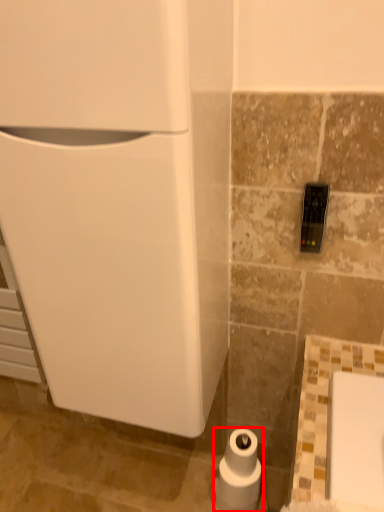
Question: Considering the relative positions of toilet paper (annotated by the red box) and appliance in the image provided, where is toilet paper (annotated by the red box) located with respect to the staircase?

Choices:
 (A) right
 (B) left

Answer: (A)